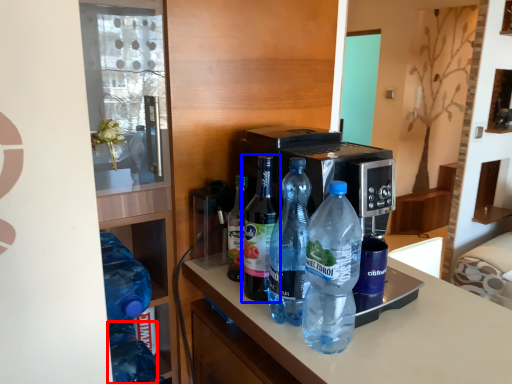
Question: Which point is further to the camera, bottle (highlighted by a red box) or bottle (highlighted by a blue box)?

Choices:
 (A) bottle
 (B) bottle

Answer: (A)